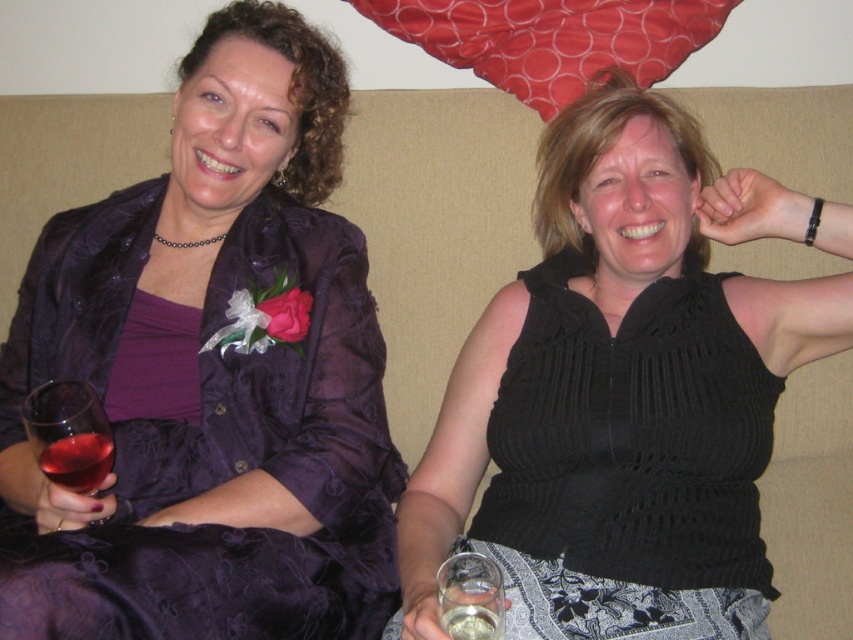
Which is behind, point (761, 605) or point (80, 476)?

The point (761, 605) is more distant.

Does black knitted top at center have a lesser width compared to translucent glass at lower left?

Incorrect, black knitted top at center's width is not less than translucent glass at lower left's.

Is point (422, 611) positioned before point (38, 449)?

Yes, point (422, 611) is closer to viewer.

Identify the location of black knitted top at center. The height and width of the screenshot is (640, 853). (625, 385).

From the picture: Is matte purple dress at center taller than black knitted top at center?

Yes.

Can you confirm if matte purple dress at center is positioned below black knitted top at center?

Incorrect, matte purple dress at center is not positioned below black knitted top at center.

Describe the element at coordinates (210, 376) in the screenshot. I see `matte purple dress at center` at that location.

The width and height of the screenshot is (853, 640). I want to click on matte purple dress at center, so click(x=210, y=376).

Who is more forward, (465, 627) or (91, 486)?

Point (465, 627) is more forward.

Is clear glass wine glass at lower center taller than translucent glass at lower left?

No, clear glass wine glass at lower center is not taller than translucent glass at lower left.

Measure the distance between clear glass wine glass at lower center and camera.

The distance of clear glass wine glass at lower center from camera is 35.95 inches.

Where is `clear glass wine glass at lower center`? clear glass wine glass at lower center is located at coordinates (469, 596).